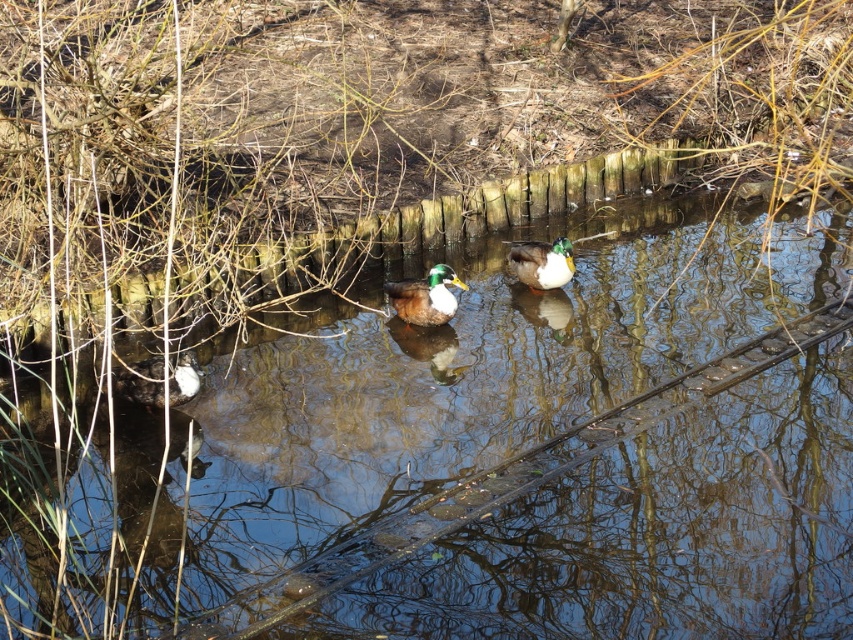
You are a small boat that is 1 meter wide. You want to sail through the area between the clear water at center and the shiny brown duck at center. Can you fit through?

The clear water at center might be wider than shiny brown duck at center, so the boat can fit through the area between them if the width is sufficient. However, the exact width isn not specified, so it depends on the actual measurement.

You are a photographer aiming to capture both the white fluffy duck at lower left and the green glossy duck at center in a single shot. Based on their positions, which duck is positioned closer to the left edge of the photo?

The white fluffy duck at lower left is positioned closer to the left edge of the photo since it is located at the lower left compared to the green glossy duck at center.